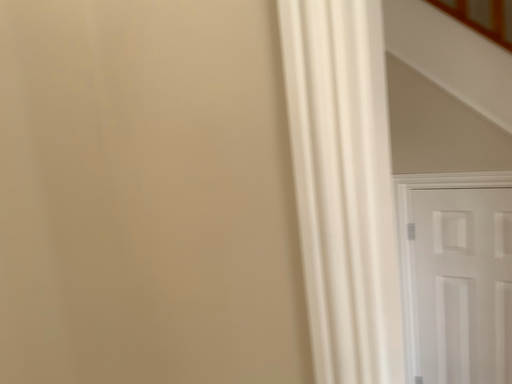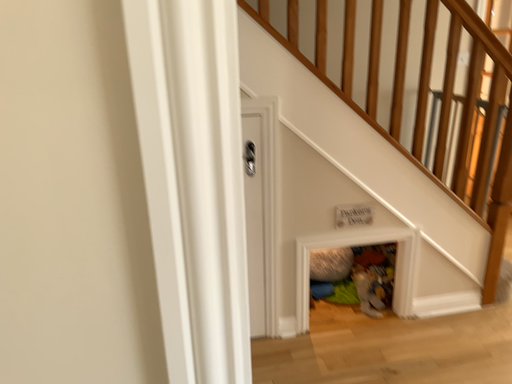
Question: Which way did the camera rotate in the video?

Choices:
 (A) rotated right
 (B) rotated left

Answer: (A)